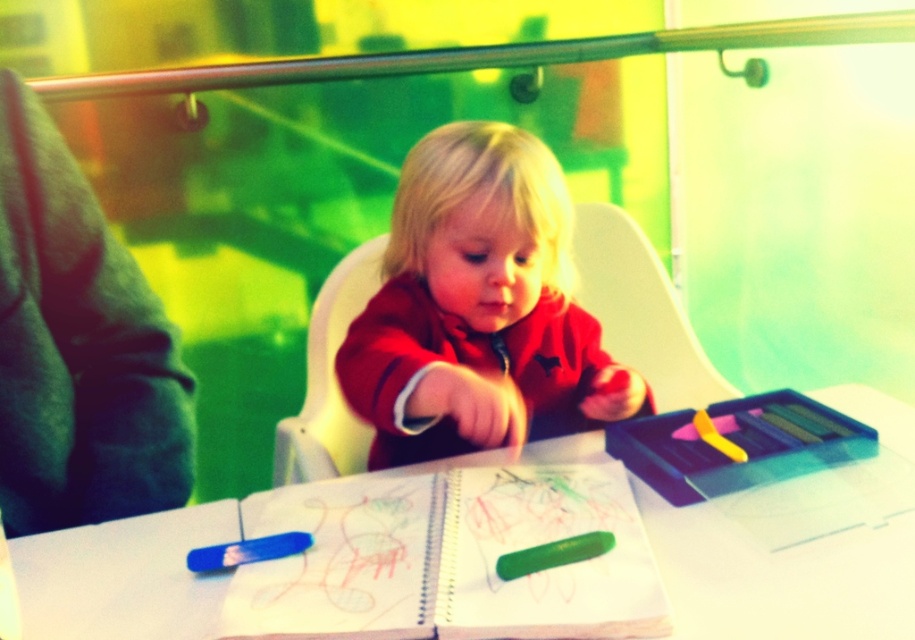
Measure the distance between point (174,621) and camera.

A distance of 29.56 inches exists between point (174,621) and camera.

Which is below, white paper at center or green fuzzy sweater at left?

white paper at center is lower down.

Measure the distance between white paper at center and camera.

white paper at center is 26.71 inches away from camera.

The height and width of the screenshot is (640, 915). What are the coordinates of `white paper at center` in the screenshot? It's located at (486, 561).

Between matte red sweater at center and green fuzzy sweater at left, which one has less height?

Standing shorter between the two is green fuzzy sweater at left.

Who is more forward, (x=497, y=148) or (x=131, y=420)?

Point (x=131, y=420) is more forward.

This screenshot has width=915, height=640. I want to click on matte red sweater at center, so click(x=478, y=307).

Between point (89, 436) and point (560, 506), which one is positioned in front?

Positioned in front is point (560, 506).

Who is lower down, green fuzzy sweater at left or green matte notebook at center?

green matte notebook at center is lower down.

This screenshot has width=915, height=640. What do you see at coordinates (78, 348) in the screenshot?
I see `green fuzzy sweater at left` at bounding box center [78, 348].

Where is `green fuzzy sweater at left`? The height and width of the screenshot is (640, 915). green fuzzy sweater at left is located at coordinates (78, 348).